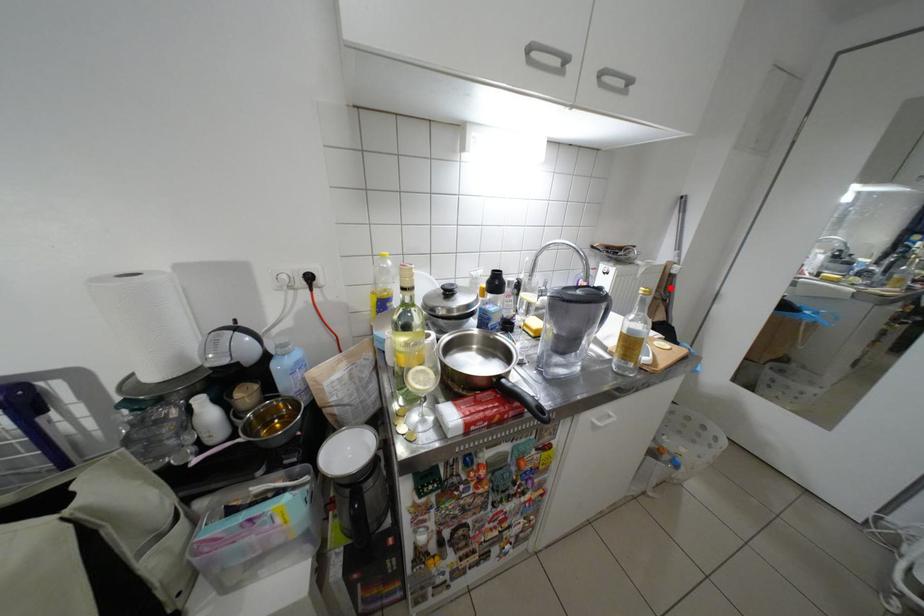
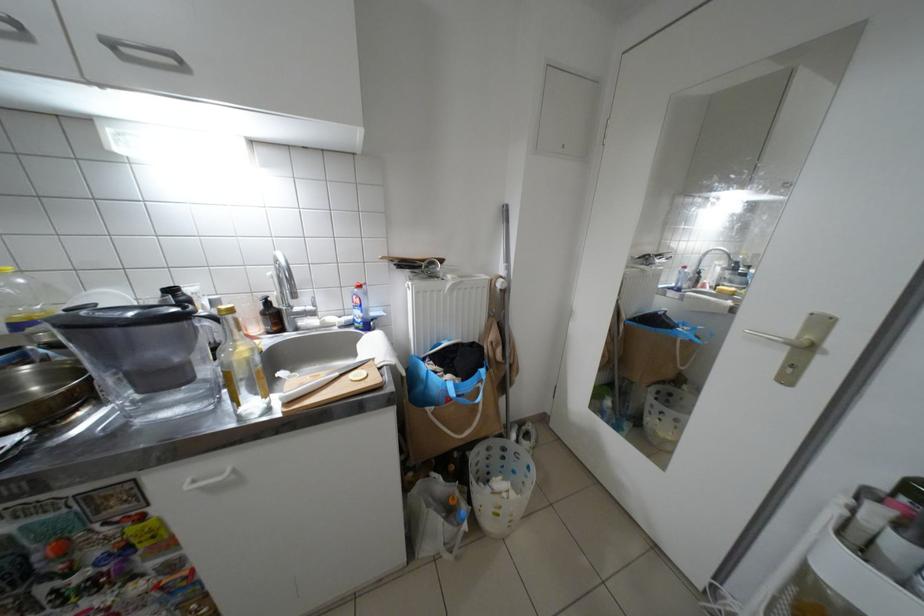
Question: I am providing you with two images of the same scene from different viewpoints. In image1, a red point is highlighted. Considering the same 3D point in image2, which of the following is correct?

Choices:
 (A) It is closer
 (B) It is farther

Answer: (A)